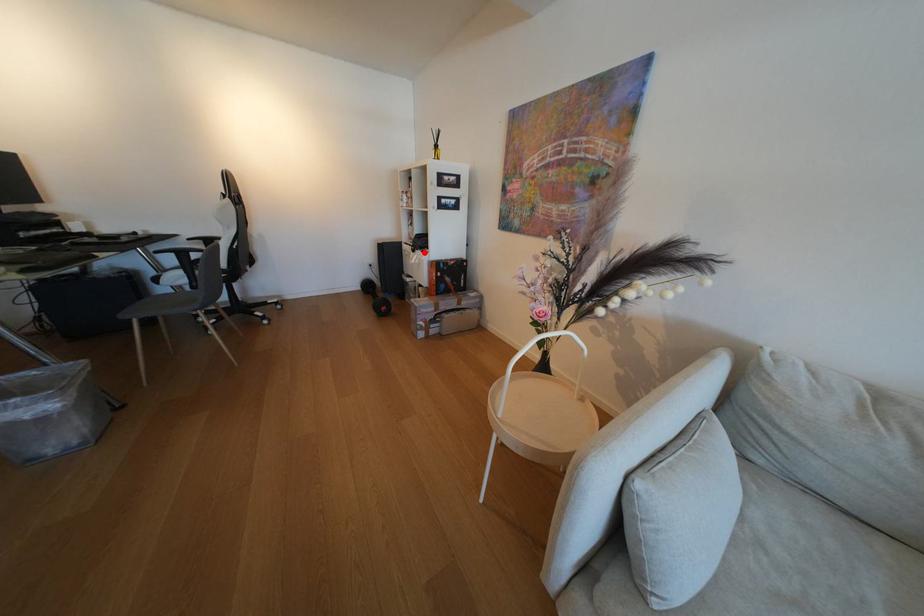
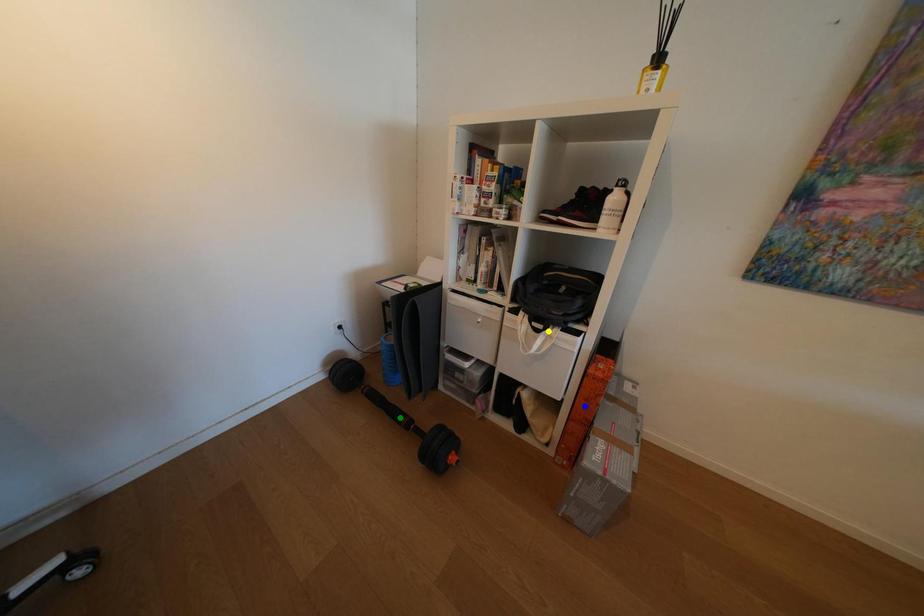
Question: I am providing you with two images of the same scene from different viewpoints. A red point is marked on the first image. You are given multiple points on the second image. Which point in image 2 is actually the same real-world point as the red point in image 1?

Choices:
 (A) green point
 (B) yellow point
 (C) blue point

Answer: (B)